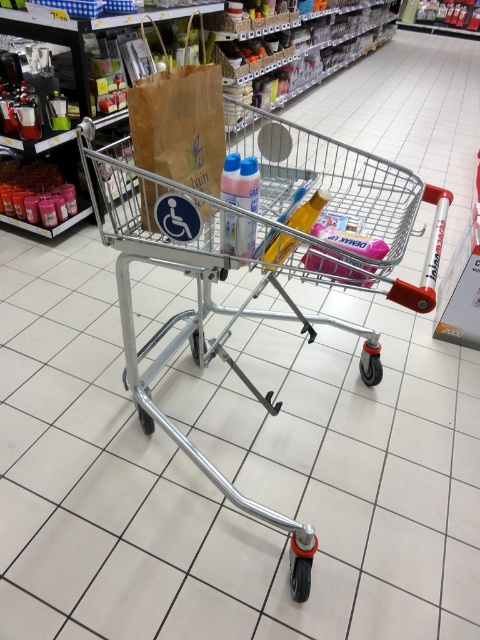
Question: Which object appears closest to the camera in this image?

Choices:
 (A) brown paper bag at center
 (B) silver metallic trolley at center

Answer: (B)

Question: Which object is farther from the camera taking this photo?

Choices:
 (A) brown paper bag at center
 (B) silver metallic trolley at center

Answer: (A)

Question: Can you confirm if silver metallic trolley at center is bigger than brown paper bag at center?

Choices:
 (A) yes
 (B) no

Answer: (A)

Question: Does silver metallic trolley at center appear over brown paper bag at center?

Choices:
 (A) no
 (B) yes

Answer: (B)

Question: Is silver metallic trolley at center wider than brown paper bag at center?

Choices:
 (A) no
 (B) yes

Answer: (B)